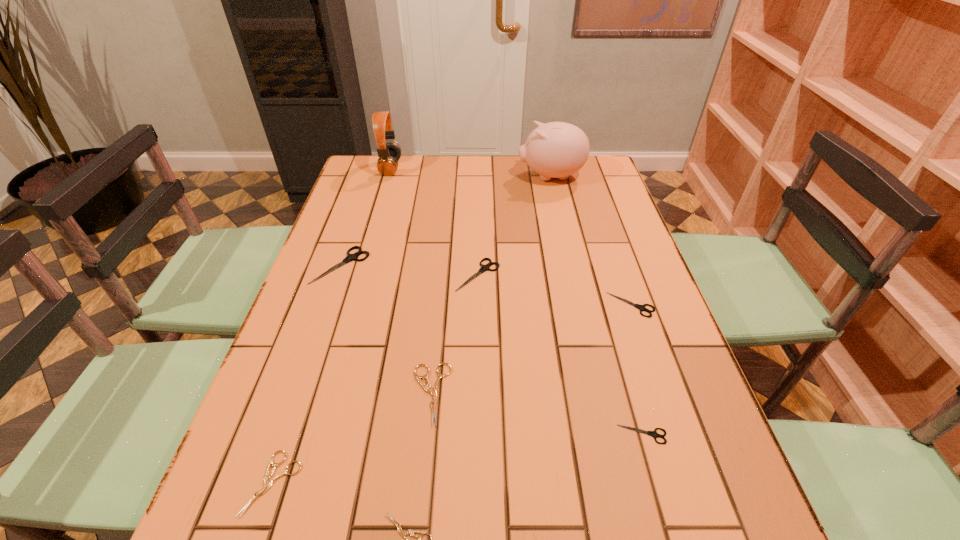
I want to click on headset, so click(390, 153).

Identify the location of piggy bank. (556, 149).

You are a GUI agent. You are given a task and a screenshot of the screen. Output one action in this format:
    pyautogui.click(x=<x>, y=<y>)
    Task: Click on the leftmost black shears
    The image size is (960, 540).
    Given the screenshot: What is the action you would take?
    pyautogui.click(x=350, y=257)

At what (x,y) coordinates should I click in order to perform the action: click on the tallest shears. Please return your answer as a coordinate pair (x, y). This screenshot has height=540, width=960. Looking at the image, I should click on (350, 257).

Locate an element on the screen. the third black shears from right to left is located at coordinates (486, 267).

At what (x,y) coordinates should I click in order to perform the action: click on the fourth tallest object. Please return your answer as a coordinate pair (x, y). Looking at the image, I should click on (486, 267).

I want to click on the fifth nearest object, so click(x=641, y=307).

Where is `the fifth nearest shears`? the fifth nearest shears is located at coordinates (641, 307).

This screenshot has width=960, height=540. Find the location of `the biggest beige shears`. the biggest beige shears is located at coordinates (x=434, y=391).

Identify the location of the second biggest beige shears. Image resolution: width=960 pixels, height=540 pixels. (268, 482).